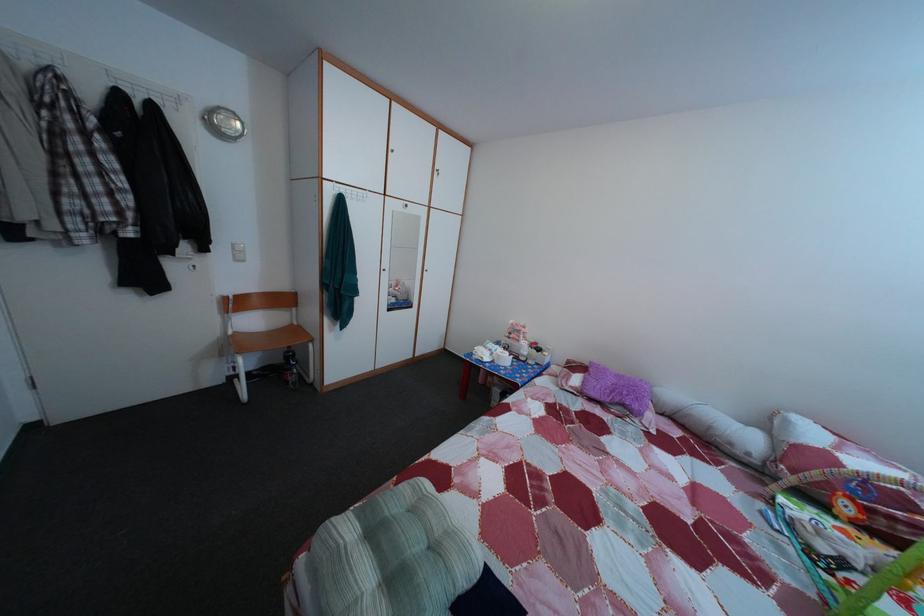
This screenshot has height=616, width=924. Identify the location of wooden chair surface. (256, 341).